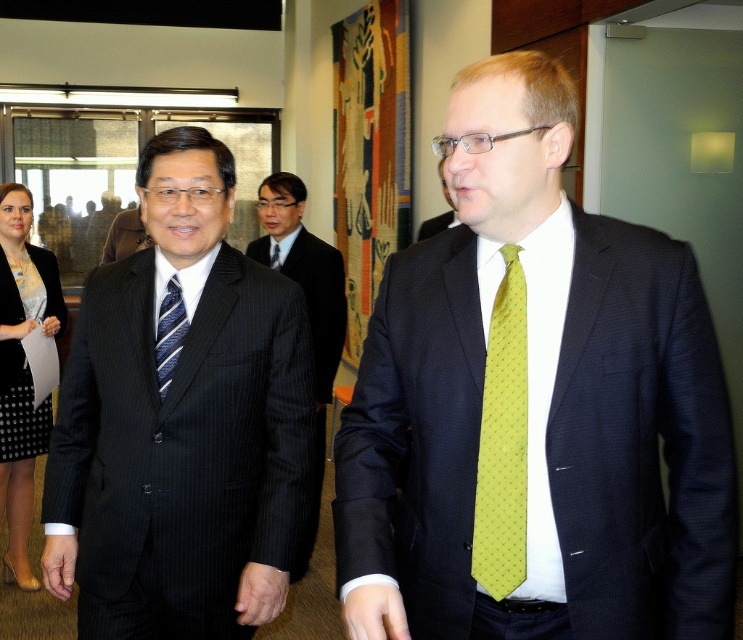
You are organizing a photoshoot and need to arrange the black dotted fabric dress at lower left and the black pinstripe suit at center according to their positions in the image. Which object should be placed to the right side of the other?

The black dotted fabric dress at lower left is to the right of the black pinstripe suit at center, so the black dotted fabric dress at lower left should be placed to the right of the black pinstripe suit at center.

You are a photographer setting up for a group photo. You need to ensure that all subjects are visible. The black dotted fabric dress at lower left and the black pinstripe suit at center are both in your frame. Which one should you adjust to avoid being blocked by the other?

The black dotted fabric dress at lower left is taller than the black pinstripe suit at center, so you should lower the black dotted fabric dress at lower left to prevent it from blocking the shorter black pinstripe suit at center.